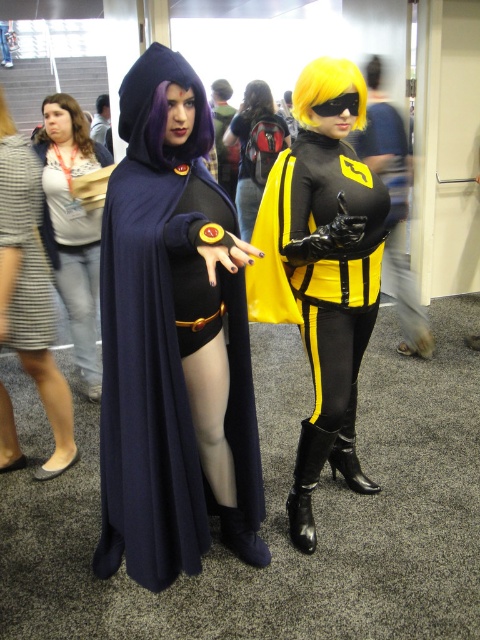
Does point (139, 401) lie in front of point (364, 86)?

Yes.

Does velvet cape at center appear on the left side of golden synthetic wig at upper right?

Yes, velvet cape at center is to the left of golden synthetic wig at upper right.

Does point (124, 449) come farther from viewer compared to point (310, 124)?

No.

Locate an element on the screen. This screenshot has height=640, width=480. velvet cape at center is located at coordinates (172, 340).

What do you see at coordinates (172, 340) in the screenshot? I see `velvet cape at center` at bounding box center [172, 340].

Does point (168, 560) come farther from viewer compared to point (232, 168)?

No.

Locate an element on the screen. velvet cape at center is located at coordinates (172, 340).

Is light brown leather jacket at center closer to the viewer compared to purple synthetic wig at upper left?

No.

Between light brown leather jacket at center and purple synthetic wig at upper left, which one has more height?

light brown leather jacket at center is taller.

Is point (108, 124) more distant than point (0, 108)?

Yes.

You are a GUI agent. You are given a task and a screenshot of the screen. Output one action in this format:
    pyautogui.click(x=<x>, y=<y>)
    Task: Click on the light brown leather jacket at center
    This screenshot has width=480, height=640.
    Given the screenshot: What is the action you would take?
    pyautogui.click(x=100, y=120)